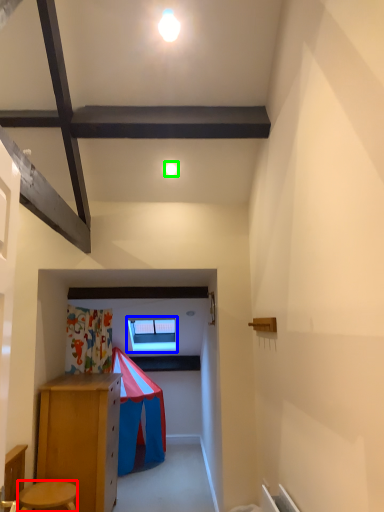
Question: Estimate the real-world distances between objects in this image. Which object is farther from stool (highlighted by a red box), window (highlighted by a blue box) or light (highlighted by a green box)?

Choices:
 (A) window
 (B) light

Answer: (A)